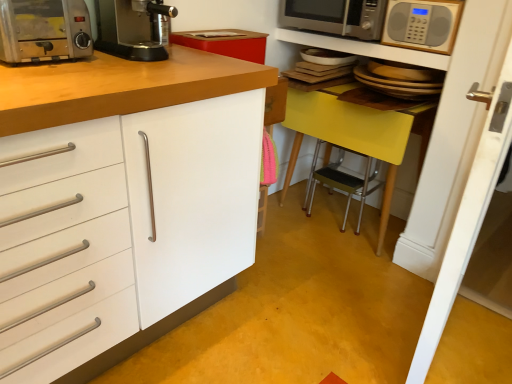
The height and width of the screenshot is (384, 512). In order to click on vacant space in front of yellow plastic table at right in this screenshot , I will do `click(349, 270)`.